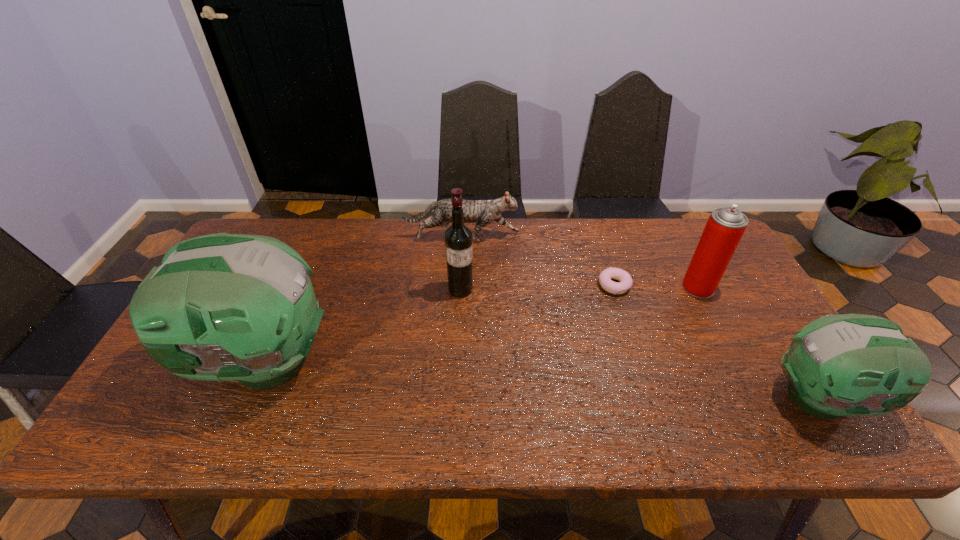
Find the location of a particular element. free space located on the visor of the leftmost object is located at coordinates (162, 361).

The image size is (960, 540). Find the location of `free space located on the face of the cat`. free space located on the face of the cat is located at coordinates (559, 238).

What are the coordinates of `blank area located on the front and back of the wine bottle` in the screenshot? It's located at (455, 404).

Identify the location of vacant region located 0.200m on the back of the third tallest object. (672, 237).

Identify the location of blank space located on the front of the shortest object. (632, 341).

What are the coordinates of `object situated at the far edge` in the screenshot? It's located at (483, 212).

Identify the location of object at the left edge. The height and width of the screenshot is (540, 960). (220, 307).

The image size is (960, 540). I want to click on football helmet that is at the right edge, so click(839, 365).

Identify the location of aerosol can that is positioned at the right edge. (725, 227).

Where is `object that is at the near left corner`? The image size is (960, 540). object that is at the near left corner is located at coordinates (220, 307).